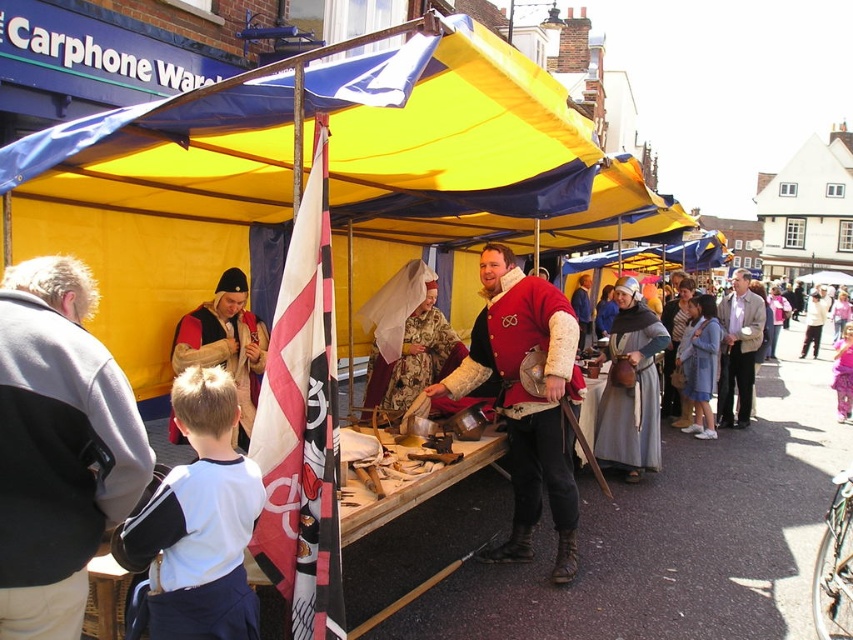
Question: Where is white cotton shirt at lower left located in relation to white cotton shirt at center in the image?

Choices:
 (A) left
 (B) right

Answer: (A)

Question: Based on their relative distances, which object is farther from the gray fleece jacket at left?

Choices:
 (A) light brown leather jacket at center
 (B) white cotton shirt at center

Answer: (B)

Question: Is floral fabric dress at center thinner than light brown leather jacket at center?

Choices:
 (A) yes
 (B) no

Answer: (A)

Question: Which point appears closest to the camera in this image?

Choices:
 (A) (82, 460)
 (B) (807, 340)
 (C) (625, 356)
 (D) (706, 369)

Answer: (A)

Question: Which point is closer to the camera?

Choices:
 (A) (541, 324)
 (B) (654, 317)

Answer: (A)

Question: From the image, what is the correct spatial relationship of light brown leather jacket at center in relation to white cotton shirt at center?

Choices:
 (A) right
 (B) left

Answer: (B)